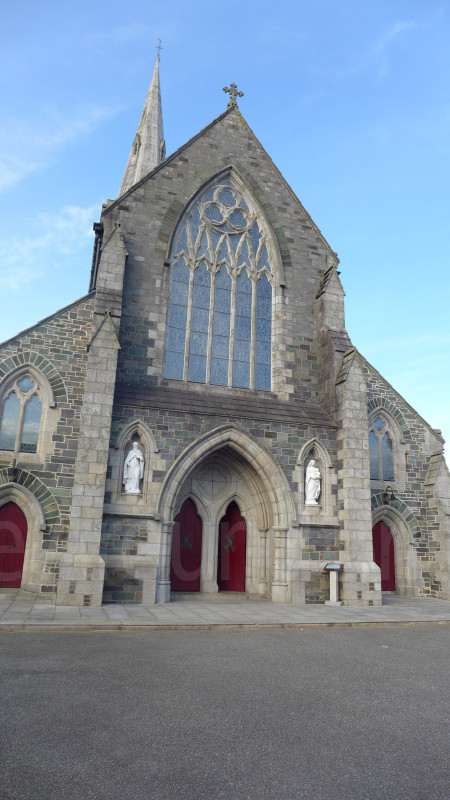
Where is `red doors`? red doors is located at coordinates (12, 529), (188, 521), (233, 522), (381, 534).